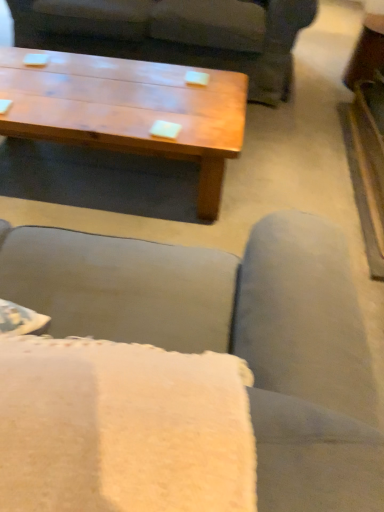
At what (x,y) coordinates should I click in order to perform the action: click on free space above wooden coffee table at upper center (from a real-world perspective). Please return your answer as a coordinate pair (x, y). The image size is (384, 512). Looking at the image, I should click on (102, 89).